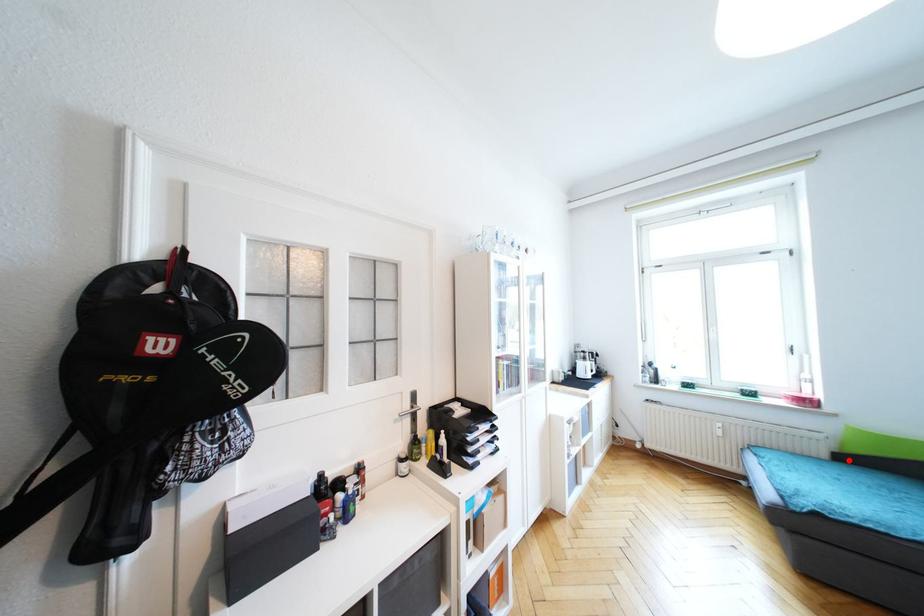
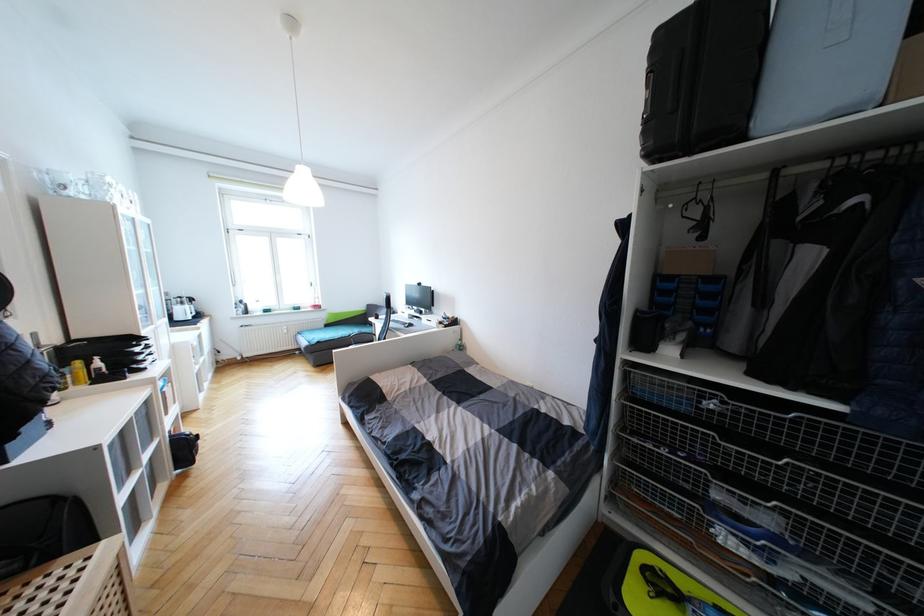
Question: I am providing you with two images of the same scene from different viewpoints. Given a red point in image1, look at the same physical point in image2. Is it:

Choices:
 (A) Closer to the viewpoint
 (B) Farther from the viewpoint

Answer: (B)